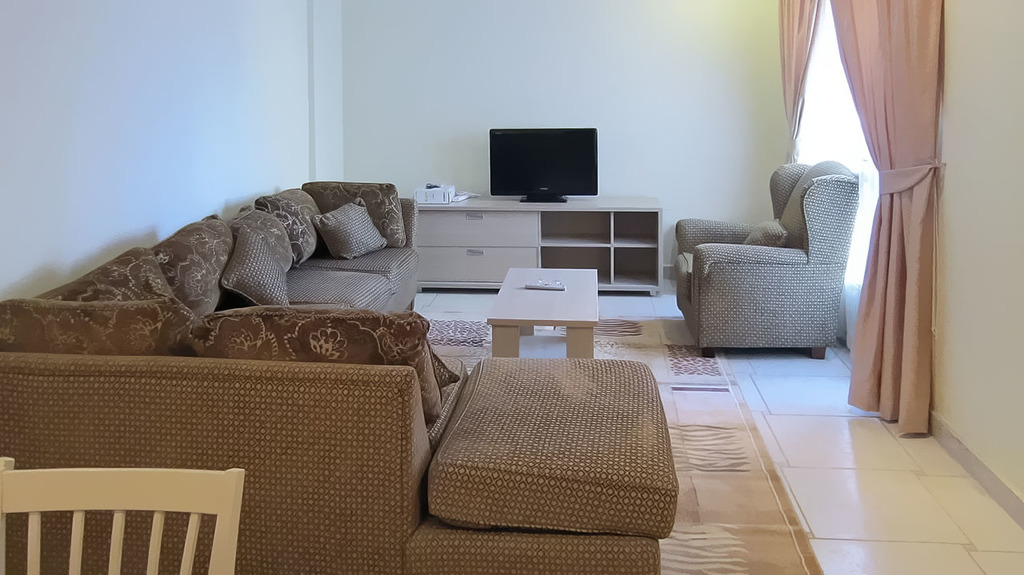
What are the coordinates of `drawers` in the screenshot? It's located at (511, 233), (505, 260).